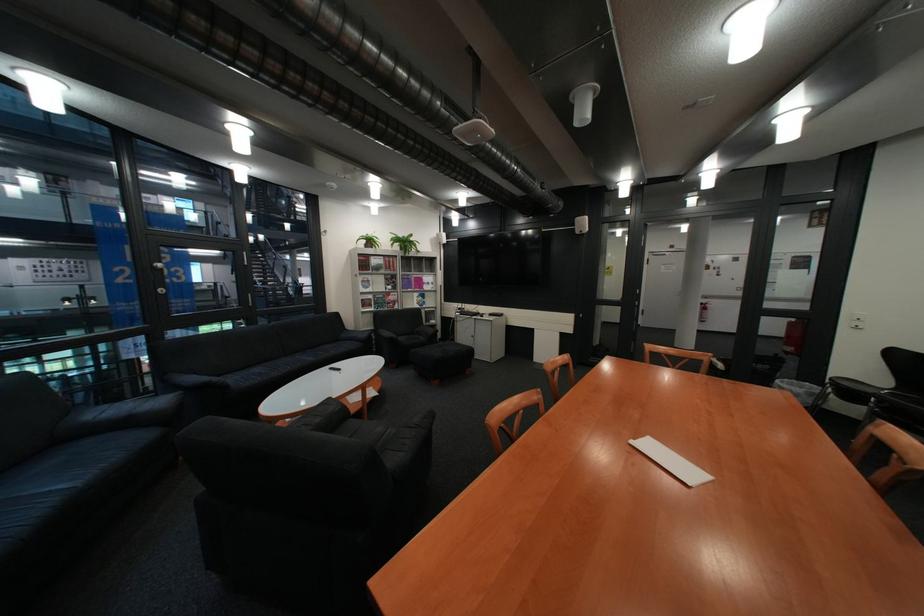
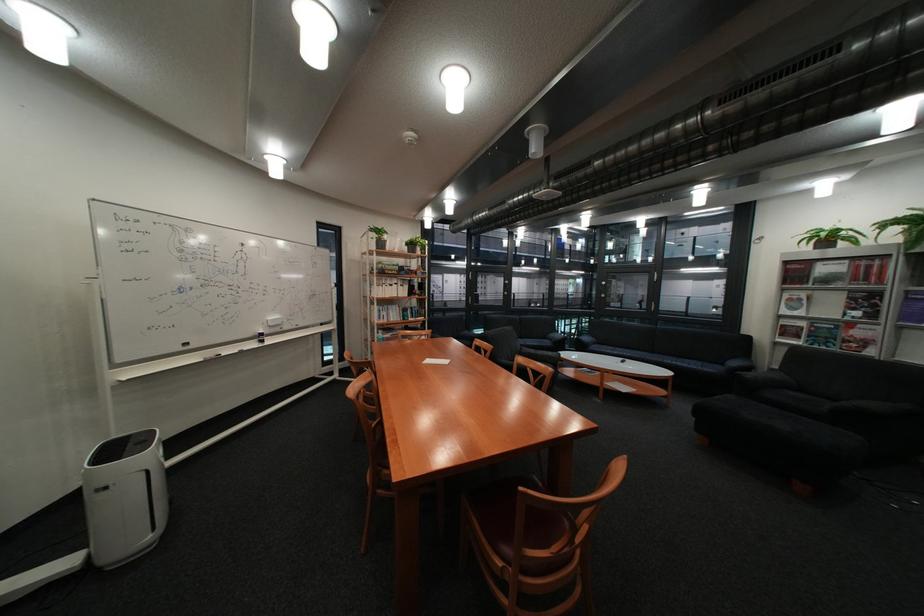
Find the pixel in the second image that matches pixel 354 341 in the first image.

(737, 363)